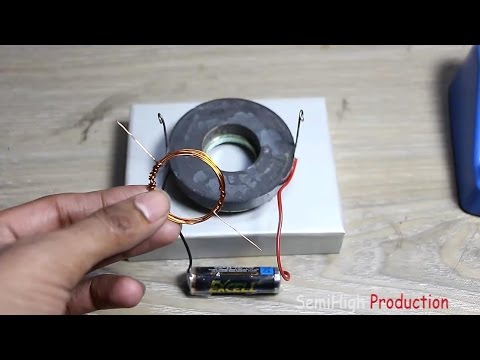
Find the location of `table`. table is located at coordinates (394, 240).